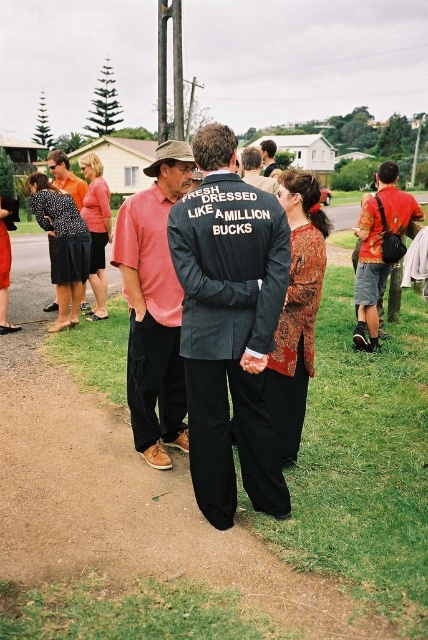
Which is above, dirt path at center or dark gray suit at center?

dark gray suit at center

Who is shorter, dirt path at center or dark gray suit at center?

With less height is dirt path at center.

Between point (154, 534) and point (258, 186), which one is positioned behind?

The point (258, 186) is more distant.

Identify the location of dirt path at center. (124, 493).

Does dark pinstripe suit at center lie in front of matte black suit at center?

Yes.

Does point (207, 164) come farther from viewer compared to point (142, 394)?

No, (207, 164) is closer to viewer.

You are a GUI agent. You are given a task and a screenshot of the screen. Output one action in this format:
    pyautogui.click(x=<x>, y=<y>)
    Task: Click on the dark pinstripe suit at center
    This screenshot has width=428, height=640.
    Given the screenshot: What is the action you would take?
    pyautogui.click(x=228, y=326)

This screenshot has height=640, width=428. In order to click on dark pinstripe suit at center in this screenshot , I will do `click(228, 326)`.

Is matte black suit at center positioned before matte black shirt at center?

Yes.

Consider the image. Is matte black suit at center shorter than matte black shirt at center?

Correct, matte black suit at center is not as tall as matte black shirt at center.

Which is behind, point (140, 307) or point (65, 186)?

The point (65, 186) is more distant.

The width and height of the screenshot is (428, 640). I want to click on matte black suit at center, so click(154, 307).